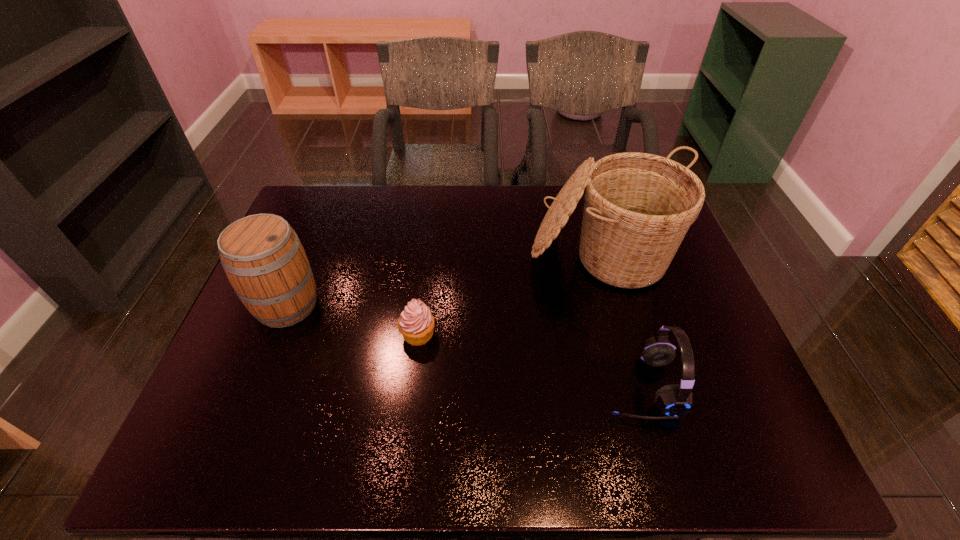
Find the location of a particular element. This screenshot has width=960, height=540. unoccupied position between the shortest object and the basket is located at coordinates 511,294.

This screenshot has height=540, width=960. I want to click on free space between the cupcake and the headset, so click(x=528, y=360).

This screenshot has height=540, width=960. What are the coordinates of `free spot between the cupcake and the third tallest object` in the screenshot? It's located at (528, 360).

Identify which object is the closest to the basket. Please provide its 2D coordinates. Your answer should be formatted as a tuple, i.e. [(x, y)], where the tuple contains the x and y coordinates of a point satisfying the conditions above.

[(674, 400)]

Identify the location of the third closest object relative to the second object from left to right. Image resolution: width=960 pixels, height=540 pixels. click(674, 400).

This screenshot has height=540, width=960. I want to click on vacant space that satisfies the following two spatial constraints: 1. on the front side of the cider; 2. on the left side of the cupcake, so click(275, 334).

This screenshot has height=540, width=960. In order to click on free spot that satisfies the following two spatial constraints: 1. on the back side of the tallest object; 2. on the left side of the cider in this screenshot , I will do `click(306, 254)`.

This screenshot has width=960, height=540. Identify the location of free space that satisfies the following two spatial constraints: 1. on the front side of the second tallest object; 2. on the left side of the shortest object. (275, 334).

You are a GUI agent. You are given a task and a screenshot of the screen. Output one action in this format:
    pyautogui.click(x=<x>, y=<y>)
    Task: Click on the blank area in the image that satisfies the following two spatial constraints: 1. on the back side of the basket; 2. on the left side of the third object from right to left
    The width and height of the screenshot is (960, 540).
    Given the screenshot: What is the action you would take?
    pyautogui.click(x=427, y=254)

What are the coordinates of `vacant region that satisfies the following two spatial constraints: 1. on the back side of the basket; 2. on the left side of the shortest object` in the screenshot? It's located at (427, 254).